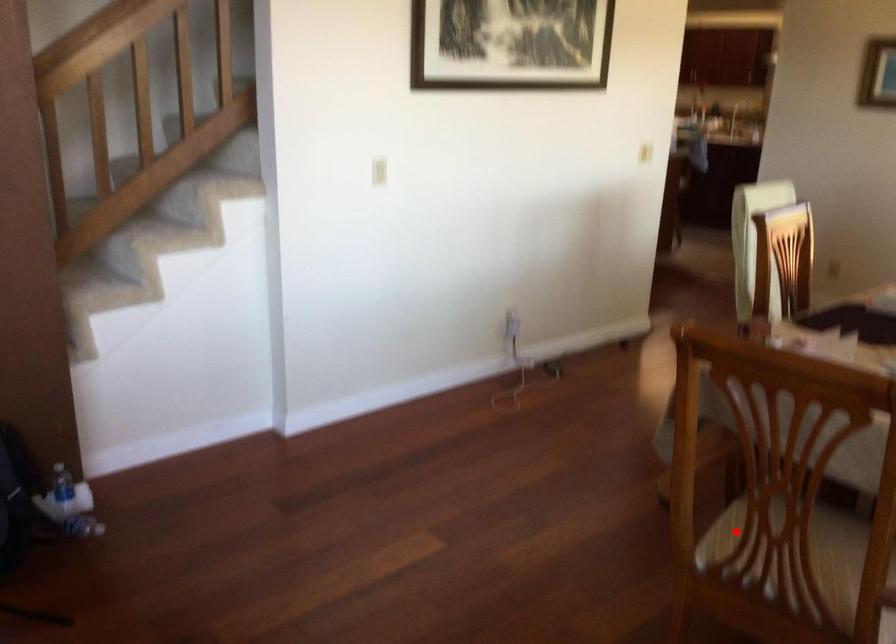
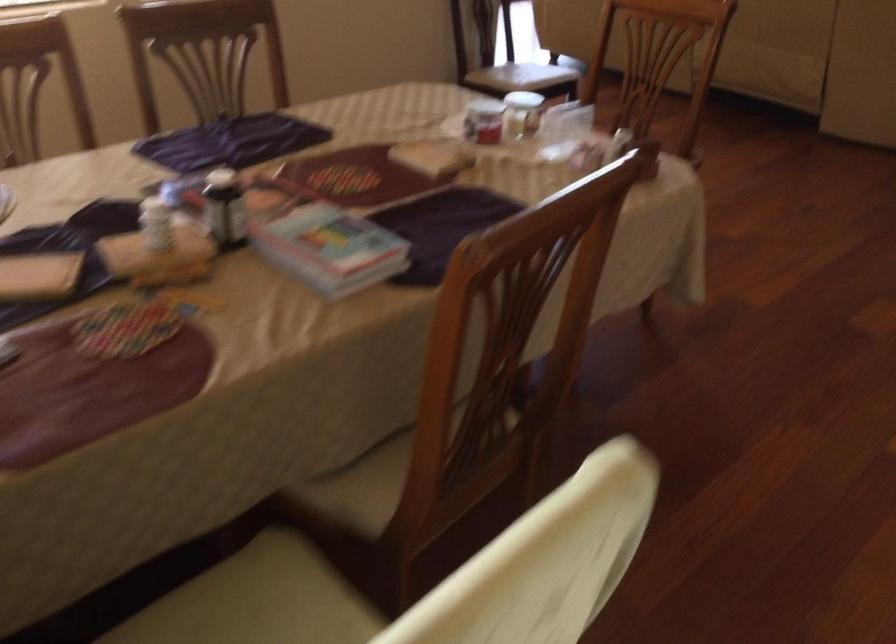
Question: I am providing you with two images of the same scene from different viewpoints. A red point is marked on the first image. At the location where the point appears in image 1, is it still visible in image 2?

Choices:
 (A) Yes
 (B) No

Answer: (B)